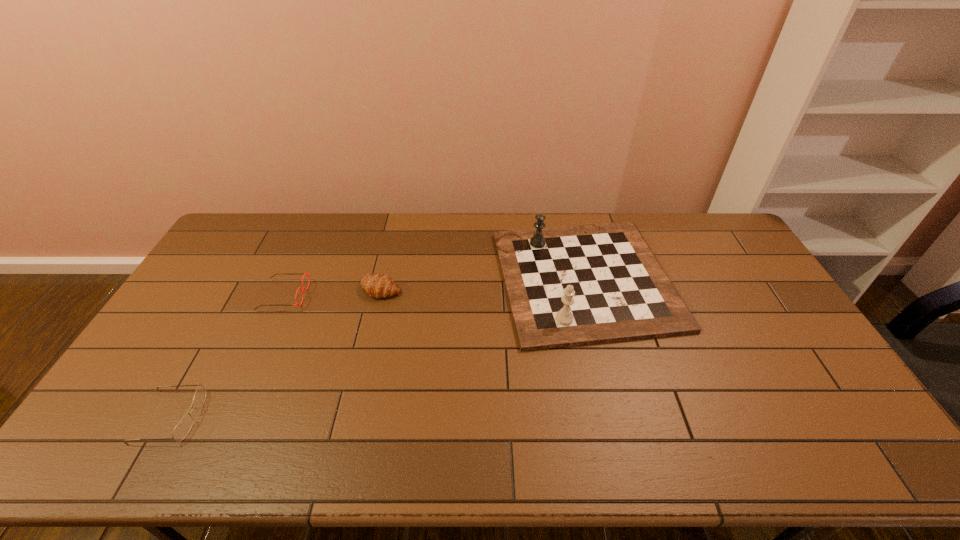
You are a GUI agent. You are given a task and a screenshot of the screen. Output one action in this format:
    pyautogui.click(x=<x>, y=<y>)
    Task: Click on the free space that is in between the shorter spectacles and the second object from right to left
    The image size is (960, 540).
    Given the screenshot: What is the action you would take?
    pyautogui.click(x=276, y=353)

Locate an element on the screen. free space that is in between the second object from right to left and the left spectacles is located at coordinates (276, 353).

This screenshot has width=960, height=540. What are the coordinates of `empty space between the farther spectacles and the gameboard` in the screenshot? It's located at (434, 287).

I want to click on free space between the crescent roll and the rightmost object, so click(x=483, y=284).

This screenshot has width=960, height=540. I want to click on free space between the right spectacles and the crescent roll, so click(332, 292).

The height and width of the screenshot is (540, 960). I want to click on vacant region between the third object from left to right and the nearer spectacles, so click(276, 353).

At what (x,y) coordinates should I click in order to perform the action: click on vacant space in between the shortest object and the second object from left to right. Please return your answer as a coordinate pair (x, y). Looking at the image, I should click on (228, 356).

Find the location of a particular element. The image size is (960, 540). unoccupied area between the tallest object and the taller spectacles is located at coordinates (434, 287).

Locate an element on the screen. object that stands as the second closest to the nearer spectacles is located at coordinates (377, 286).

The width and height of the screenshot is (960, 540). Find the location of `the third closest object to the crescent roll`. the third closest object to the crescent roll is located at coordinates (182, 429).